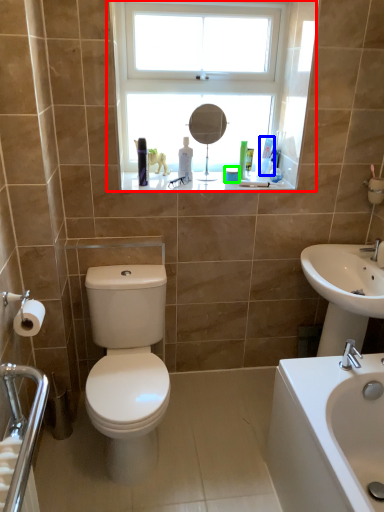
Question: Which is farther away from window (highlighted by a red box)? toiletry (highlighted by a blue box) or toiletry (highlighted by a green box)?

Choices:
 (A) toiletry
 (B) toiletry

Answer: (B)